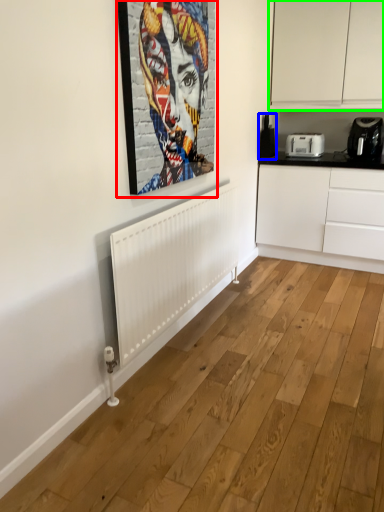
Question: Considering the real-world distances, which object is closest to picture frame (highlighted by a red box)? appliance (highlighted by a blue box) or cabinetry (highlighted by a green box).

Choices:
 (A) appliance
 (B) cabinetry

Answer: (B)